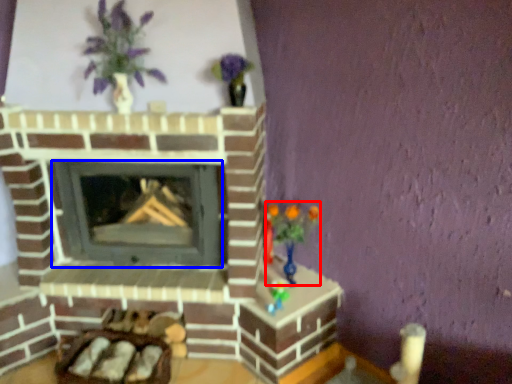
Question: Among these objects, which one is nearest to the camera, toy (highlighted by a red box) or wood burning stove (highlighted by a blue box)?

Choices:
 (A) toy
 (B) wood burning stove

Answer: (A)